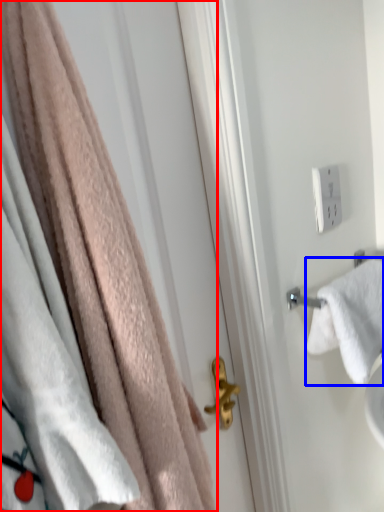
Question: Among these objects, which one is nearest to the camera, towel (highlighted by a red box) or towel (highlighted by a blue box)?

Choices:
 (A) towel
 (B) towel

Answer: (A)